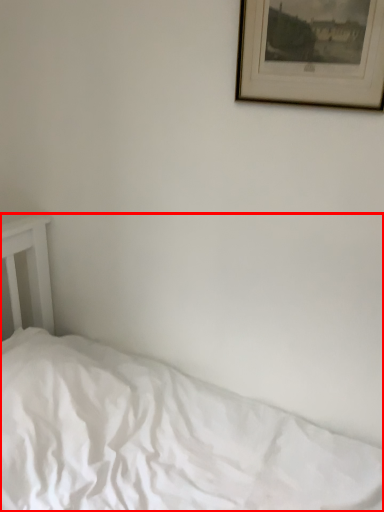
Question: In this image, where is bed (annotated by the red box) located relative to picture frame?

Choices:
 (A) right
 (B) left

Answer: (B)